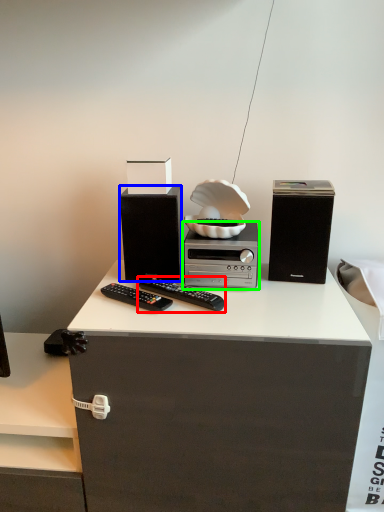
Question: Which is farther away from remote control (highlighted by a red box)? speaker (highlighted by a blue box) or home appliance (highlighted by a green box)?

Choices:
 (A) speaker
 (B) home appliance

Answer: (A)